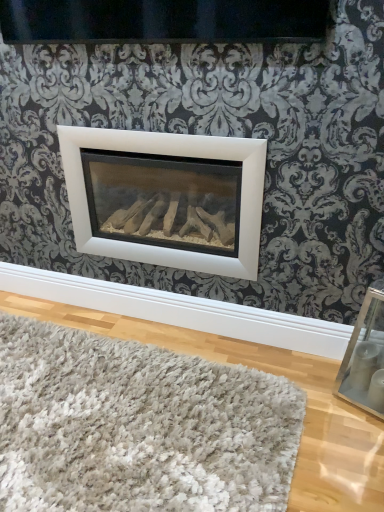
What do you see at coordinates (365, 356) in the screenshot? I see `clear glass picture frame at lower right` at bounding box center [365, 356].

What do you see at coordinates (166, 198) in the screenshot? I see `white matte fireplace at center` at bounding box center [166, 198].

Identify the location of white shaggy rug at lower center. (138, 426).

Which point is more forward, (371, 392) or (30, 346)?

The point (371, 392) is in front.

Based on their sizes in the image, would you say clear glass picture frame at lower right is bigger or smaller than white shaggy rug at lower center?

Clearly, clear glass picture frame at lower right is smaller in size than white shaggy rug at lower center.

Does clear glass picture frame at lower right contain white shaggy rug at lower center?

No, white shaggy rug at lower center is located outside of clear glass picture frame at lower right.

Where is `mat on the left of the clear glass picture frame at lower right`? The width and height of the screenshot is (384, 512). mat on the left of the clear glass picture frame at lower right is located at coordinates (138, 426).

Identify the location of fireplace behind the white shaggy rug at lower center. (166, 198).

Does white shaggy rug at lower center have a larger size compared to white matte fireplace at center?

No.

Are white shaggy rug at lower center and white matte fireplace at center beside each other?

There is a gap between white shaggy rug at lower center and white matte fireplace at center.

Is white matte fireplace at center not near clear glass picture frame at lower right?

They are positioned close to each other.

Considering the relative sizes of white matte fireplace at center and clear glass picture frame at lower right in the image provided, is white matte fireplace at center smaller than clear glass picture frame at lower right?

Actually, white matte fireplace at center might be larger than clear glass picture frame at lower right.

Based on the photo, is white matte fireplace at center positioned with its back to clear glass picture frame at lower right?

white matte fireplace at center does not have its back to clear glass picture frame at lower right.

Is white matte fireplace at center not inside clear glass picture frame at lower right?

Yes.

Can you see clear glass picture frame at lower right touching white matte fireplace at center?

No.

Is point (355, 347) closer or farther from the camera than point (123, 155)?

Point (355, 347) is positioned closer to the camera compared to point (123, 155).

From the image's perspective, does clear glass picture frame at lower right appear lower than white matte fireplace at center?

Indeed, from the image's perspective, clear glass picture frame at lower right is shown beneath white matte fireplace at center.

Relative to clear glass picture frame at lower right, is white shaggy rug at lower center in front or behind?

white shaggy rug at lower center is in front of clear glass picture frame at lower right.

In the scene shown: From the image's perspective, which is below, white shaggy rug at lower center or clear glass picture frame at lower right?

From the image's view, white shaggy rug at lower center is below.

In the scene shown: Between white shaggy rug at lower center and clear glass picture frame at lower right, which one has larger width?

Wider between the two is white shaggy rug at lower center.

Which is more to the left, white shaggy rug at lower center or clear glass picture frame at lower right?

white shaggy rug at lower center is more to the left.

Can white shaggy rug at lower center be found inside white matte fireplace at center?

No, white shaggy rug at lower center is not inside white matte fireplace at center.

From a real-world perspective, which is physically above, white matte fireplace at center or white shaggy rug at lower center?

white matte fireplace at center, from a real-world perspective.

At what (x,y) coordinates should I click in order to perform the action: click on fireplace located above the white shaggy rug at lower center (from the image's perspective). Please return your answer as a coordinate pair (x, y). Looking at the image, I should click on (166, 198).

Considering the relative sizes of white matte fireplace at center and white shaggy rug at lower center in the image provided, is white matte fireplace at center taller than white shaggy rug at lower center?

Yes.

The width and height of the screenshot is (384, 512). I want to click on picture frame lying above the white shaggy rug at lower center (from the image's perspective), so click(365, 356).

Where is `mat below the white matte fireplace at center (from the image's perspective)`? This screenshot has height=512, width=384. mat below the white matte fireplace at center (from the image's perspective) is located at coordinates (138, 426).

Estimate the real-world distances between objects in this image. Which object is further from clear glass picture frame at lower right, white shaggy rug at lower center or white matte fireplace at center?

Among the two, white matte fireplace at center is located further to clear glass picture frame at lower right.

Based on their spatial positions, is white shaggy rug at lower center or clear glass picture frame at lower right further from white matte fireplace at center?

clear glass picture frame at lower right.

Which object lies nearer to the anchor point white matte fireplace at center, clear glass picture frame at lower right or white shaggy rug at lower center?

white shaggy rug at lower center is positioned closer to the anchor white matte fireplace at center.

From the image, which object appears to be nearer to clear glass picture frame at lower right, white matte fireplace at center or white shaggy rug at lower center?

white shaggy rug at lower center.

Considering their positions, is clear glass picture frame at lower right positioned closer to white shaggy rug at lower center than white matte fireplace at center?

clear glass picture frame at lower right is positioned closer to the anchor white shaggy rug at lower center.

From the image, which object appears to be nearer to white shaggy rug at lower center, white matte fireplace at center or clear glass picture frame at lower right?

Based on the image, clear glass picture frame at lower right appears to be nearer to white shaggy rug at lower center.

At what (x,y) coordinates should I click in order to perform the action: click on fireplace located between white shaggy rug at lower center and clear glass picture frame at lower right in the left-right direction. Please return your answer as a coordinate pair (x, y). The width and height of the screenshot is (384, 512). Looking at the image, I should click on (166, 198).